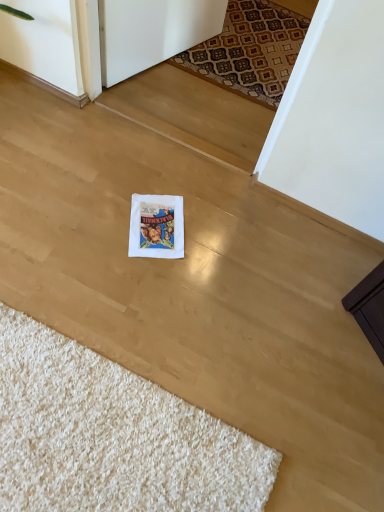
Where is `empty space that is ontop of white paper postcard at center (from a real-world perspective)`? The width and height of the screenshot is (384, 512). empty space that is ontop of white paper postcard at center (from a real-world perspective) is located at coordinates (163, 220).